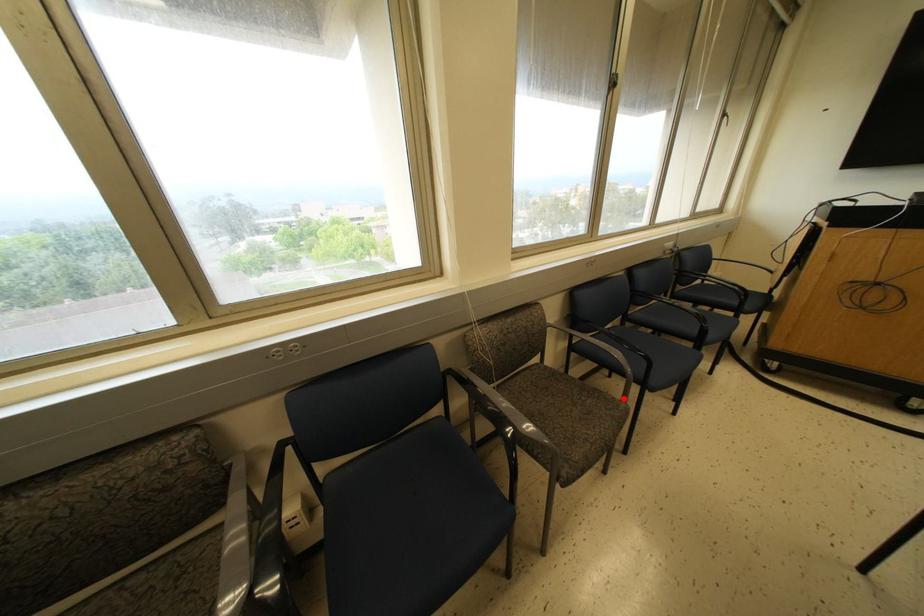
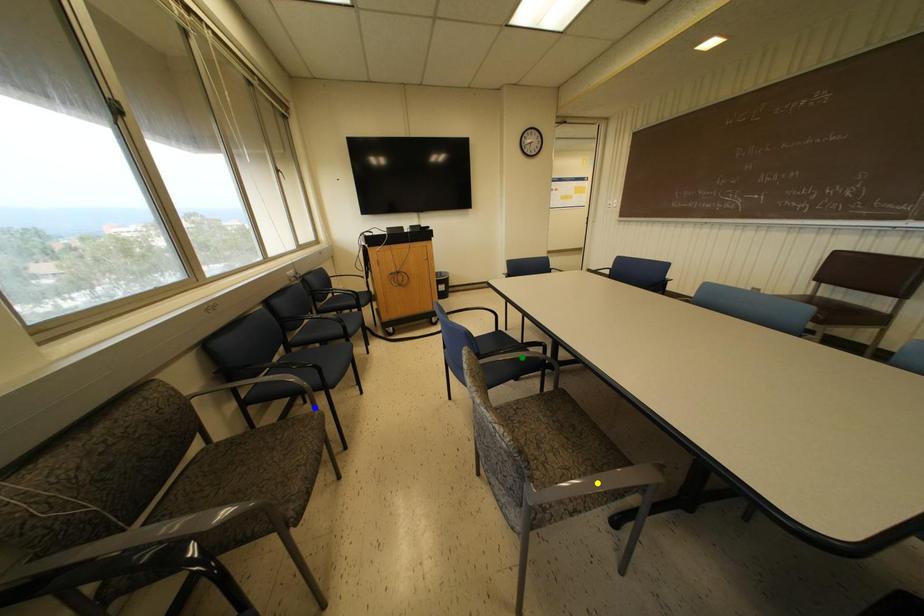
Question: I am providing you with two images of the same scene from different viewpoints. A red point is marked on the first image. You are given multiple points on the second image. Can you choose the point in image 2 that corresponds to the point in image 1?

Choices:
 (A) green point
 (B) yellow point
 (C) blue point

Answer: (C)